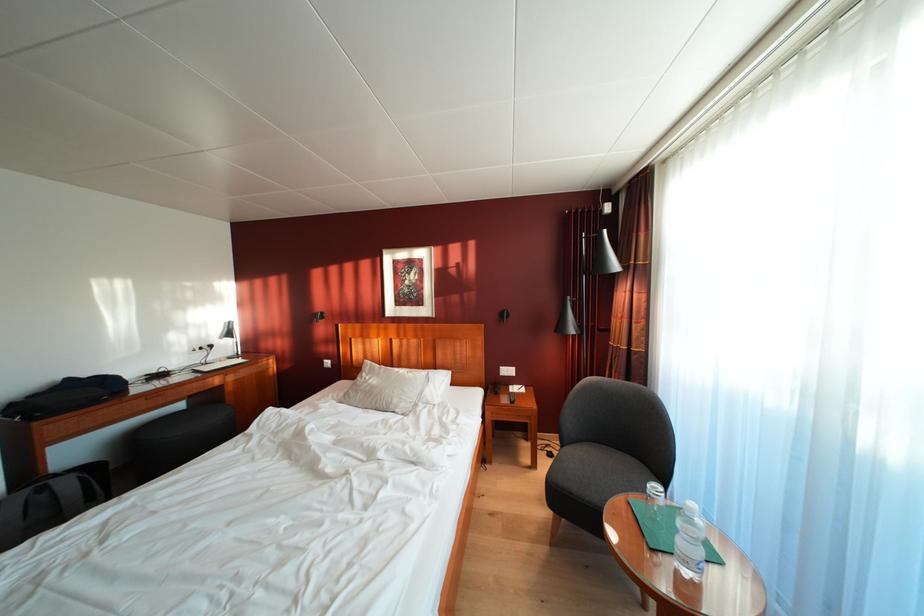
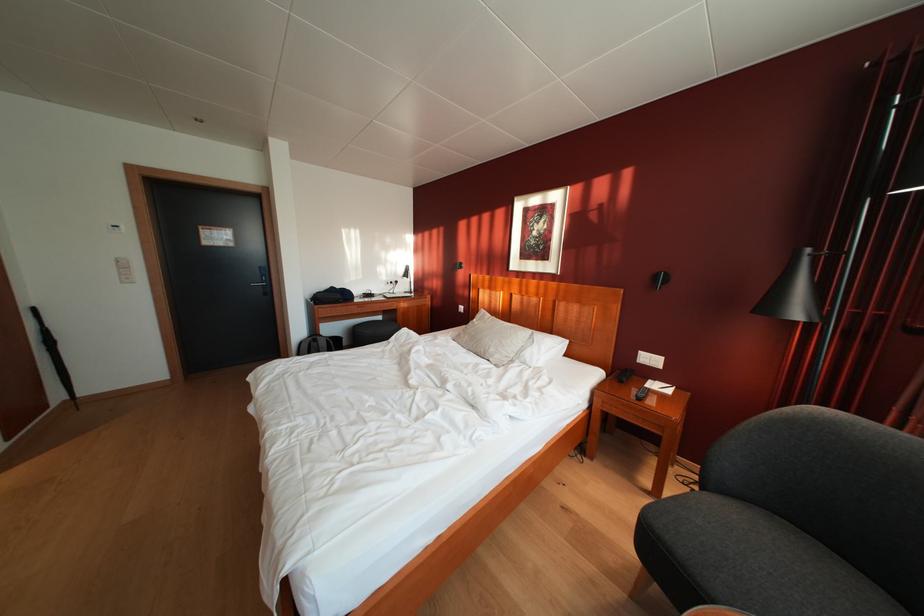
Question: The images are taken continuously from a first-person perspective. In which direction is your viewpoint rotating?

Choices:
 (A) Left
 (B) Right
 (C) Up
 (D) Down

Answer: (A)